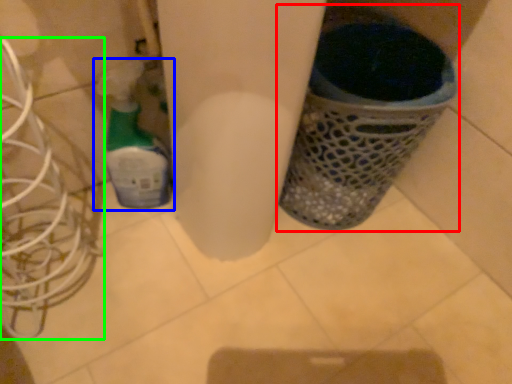
Question: Which object is positioned farthest from waste container (highlighted by a red box)? Select from bottle (highlighted by a blue box) and wire (highlighted by a green box).

Choices:
 (A) bottle
 (B) wire

Answer: (B)